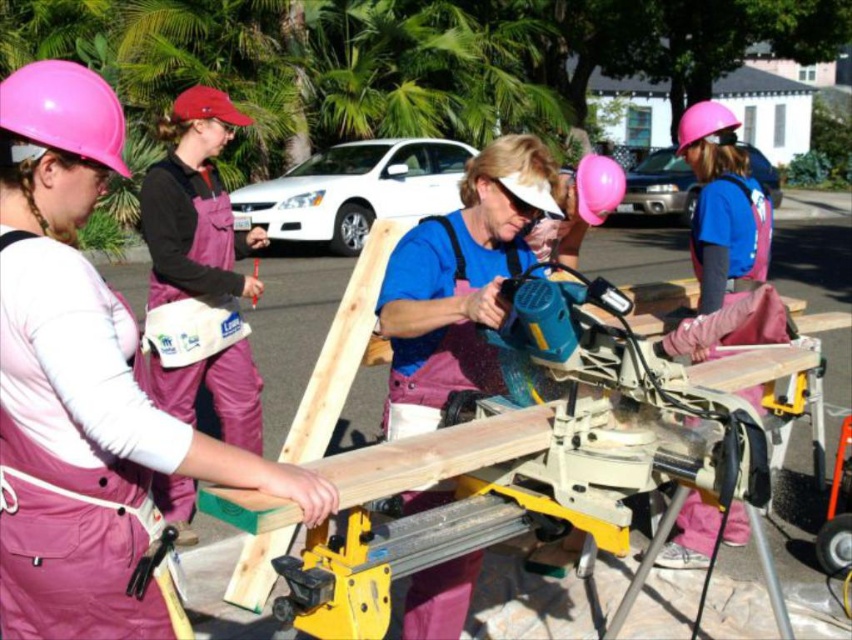
Is pink matte helmet at upper left below pink matte balloon at center?

Yes.

Is point (73, 122) positioned in front of point (597, 157)?

Yes, point (73, 122) is closer to viewer.

Between point (58, 86) and point (611, 179), which one is positioned behind?

Point (611, 179)

The height and width of the screenshot is (640, 852). I want to click on pink matte helmet at upper left, so click(65, 109).

Is pink matte balloon at center to the left of pink matte helmet at upper center from the viewer's perspective?

Correct, you'll find pink matte balloon at center to the left of pink matte helmet at upper center.

What do you see at coordinates (597, 188) in the screenshot?
I see `pink matte balloon at center` at bounding box center [597, 188].

At what (x,y) coordinates should I click in order to perform the action: click on pink matte balloon at center. Please return your answer as a coordinate pair (x, y). This screenshot has height=640, width=852. Looking at the image, I should click on (597, 188).

Is pink matte helmet at upper left bigger than pink matte helmet at upper center?

Incorrect, pink matte helmet at upper left is not larger than pink matte helmet at upper center.

Can you confirm if pink matte helmet at upper left is shorter than pink matte helmet at upper center?

Yes, pink matte helmet at upper left is shorter than pink matte helmet at upper center.

Who is more distant from viewer, (27, 132) or (718, 109)?

Positioned behind is point (718, 109).

The image size is (852, 640). I want to click on pink matte helmet at upper left, so click(x=65, y=109).